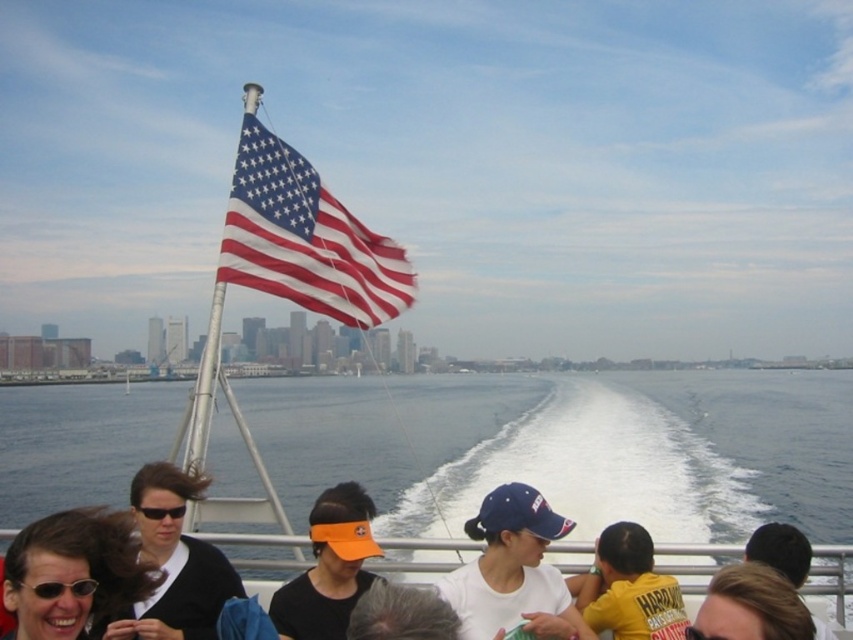
Question: Does clear blue water at center have a larger size compared to yellow cotton shirt at lower right?

Choices:
 (A) yes
 (B) no

Answer: (A)

Question: Does orange visor at center appear on the right side of yellow cotton shirt at lower right?

Choices:
 (A) no
 (B) yes

Answer: (A)

Question: Can you confirm if clear blue water at center is smaller than blonde hair at lower right?

Choices:
 (A) yes
 (B) no

Answer: (B)

Question: Which point is farther from the camera taking this photo?

Choices:
 (A) (57, 604)
 (B) (763, 609)
 (C) (294, 588)
 (D) (372, 467)

Answer: (D)

Question: Which of the following is the closest to the observer?

Choices:
 (A) matte fabric flag at upper center
 (B) blonde hair at lower right
 (C) clear blue water at center
 (D) matte black sunglasses at lower left

Answer: (B)

Question: Which point is farther to the camera?

Choices:
 (A) orange visor at center
 (B) blue fabric cap at center
 (C) blonde hair at lower right
 (D) yellow cotton shirt at lower right

Answer: (A)